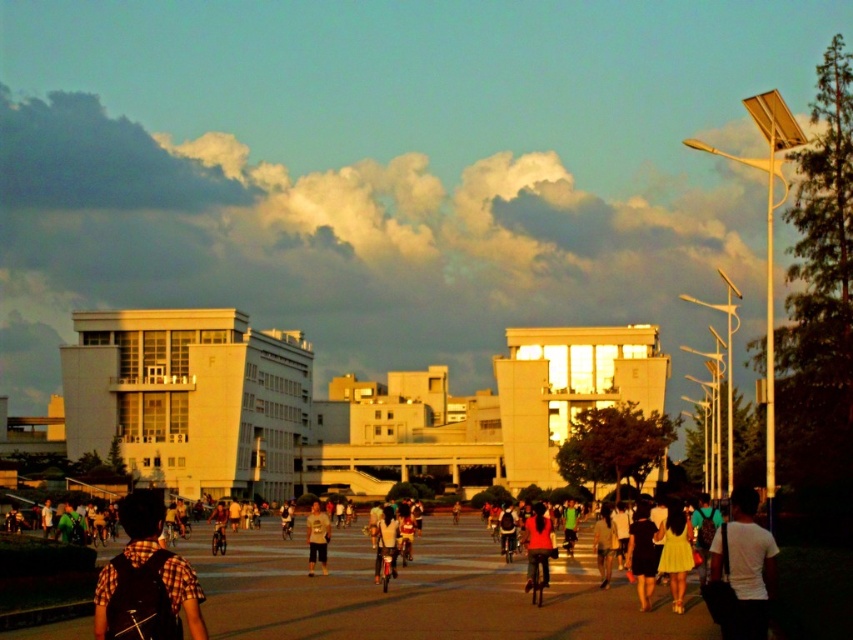
You are a photographer standing in the open paved area and want to take a photo of the yellow matte dress at center and the light gray cotton shirt at center. Which one should you zoom in on to capture the person wearing it more clearly?

The yellow matte dress at center is not as tall as the light gray cotton shirt at center, so you should zoom in on the light gray cotton shirt at center to capture it more clearly because it is taller.

You are standing at the edge of the open paved area and see both the yellow matte dress at center and the light gray cotton shirt at center. Which one is positioned to the right?

The yellow matte dress at center is positioned to the right of the light gray cotton shirt at center.